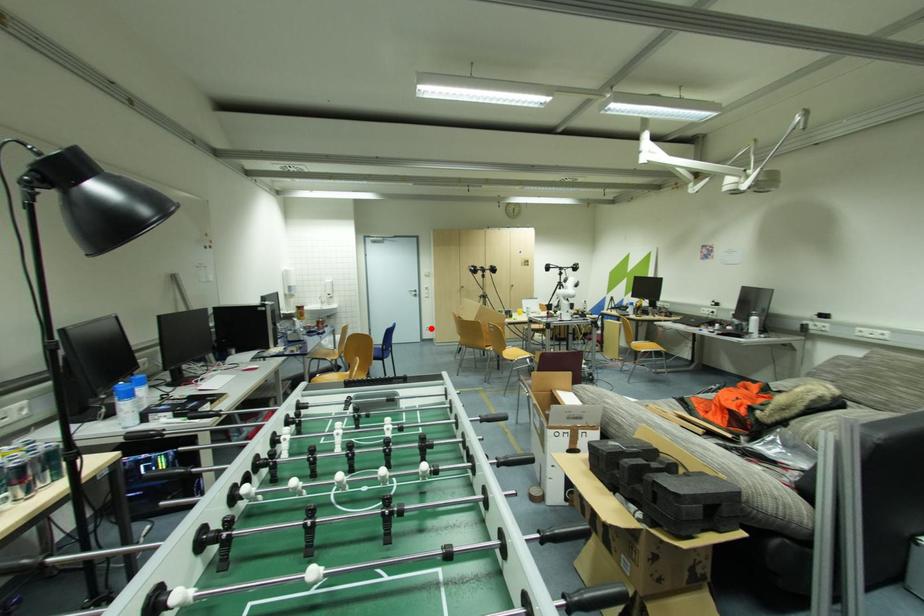
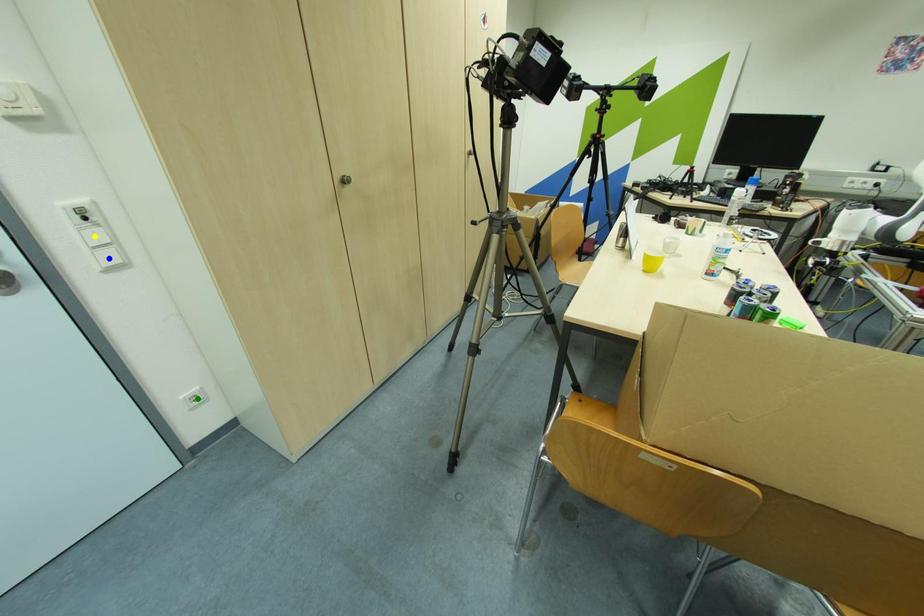
Question: I am providing you with two images of the same scene from different viewpoints. A red point is marked on the first image. You are given multiple points on the second image. Which mark in image 2 goes with the point in image 1?

Choices:
 (A) yellow point
 (B) blue point
 (C) green point

Answer: (C)